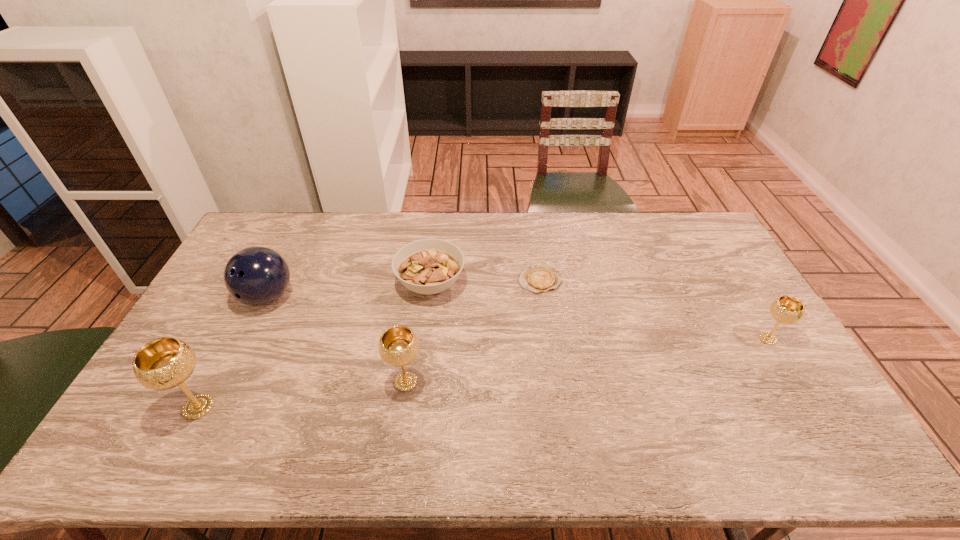
Where is `blank area located on the back of the second chalice from left to right`? The image size is (960, 540). blank area located on the back of the second chalice from left to right is located at coordinates (418, 298).

Locate an element on the screen. vacant region located on the left of the rightmost chalice is located at coordinates (690, 339).

At what (x,y) coordinates should I click in order to perform the action: click on vacant space located on the left of the stew. Please return your answer as a coordinate pair (x, y). The image size is (960, 540). Looking at the image, I should click on (330, 284).

Locate an element on the screen. free spot located 0.390m on the front of the shortest object is located at coordinates (558, 399).

What are the coordinates of `free point located 0.100m on the surface of the bowling ball near the finger holes` in the screenshot? It's located at (244, 344).

Where is `chalice at the left edge`? This screenshot has width=960, height=540. chalice at the left edge is located at coordinates (164, 363).

Find the location of a particular element. The width and height of the screenshot is (960, 540). bowling ball located at the left edge is located at coordinates (255, 276).

You are a GUI agent. You are given a task and a screenshot of the screen. Output one action in this format:
    pyautogui.click(x=<x>, y=<y>)
    Task: Click on the object positioned at the right edge
    This screenshot has height=540, width=960.
    Given the screenshot: What is the action you would take?
    pyautogui.click(x=788, y=310)

This screenshot has height=540, width=960. Identify the location of object present at the near left corner. (164, 363).

Locate an element on the screen. This screenshot has height=540, width=960. blank area at the far edge is located at coordinates (603, 214).